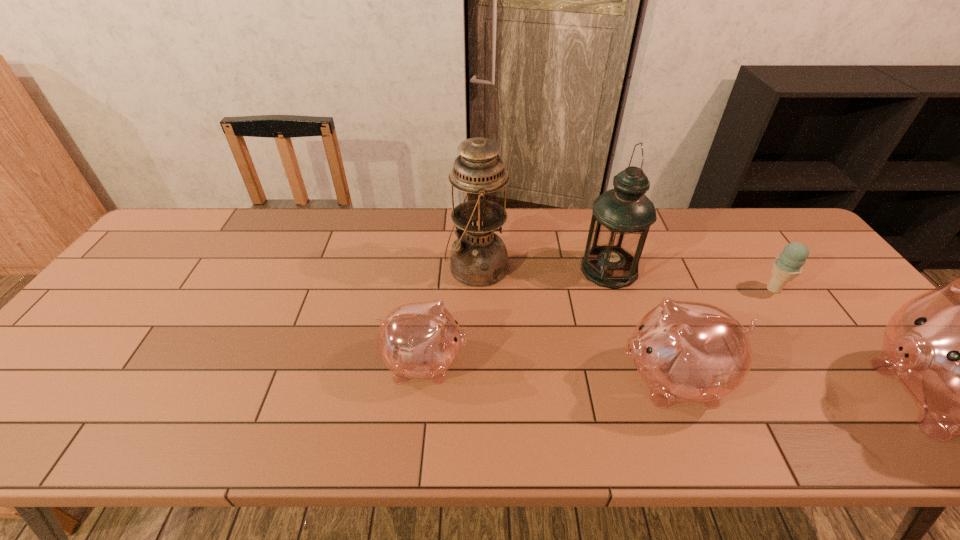
In the current image, all piggy banks are evenly spaced. To maintain this equal spacing, where should an additional piggy bank be placed on the left? Please point out a free spot. Please provide its 2D coordinates. Your answer should be formatted as a tuple, i.e. [(x, y)], where the tuple contains the x and y coordinates of a point satisfying the conditions above.

[(194, 347)]